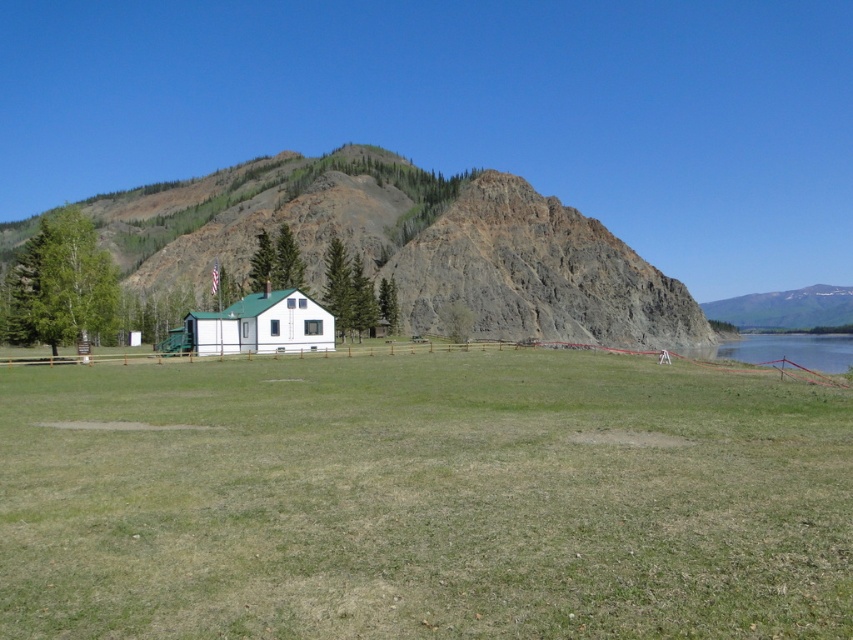
Question: Estimate the real-world distances between objects in this image. Which object is closer to the white matte cabin at center?

Choices:
 (A) green grassy field at center
 (B) rustic stone mountain at center

Answer: (A)

Question: Which of these objects is positioned closest to the green grassy field at center?

Choices:
 (A) rustic stone mountain at center
 (B) white matte cabin at center

Answer: (B)

Question: Which point is farther from the camera taking this photo?

Choices:
 (A) (283, 310)
 (B) (180, 627)
 (C) (560, 204)

Answer: (C)

Question: Is rustic stone mountain at center above white matte cabin at center?

Choices:
 (A) yes
 (B) no

Answer: (A)

Question: Can you confirm if rustic stone mountain at center is wider than white matte cabin at center?

Choices:
 (A) no
 (B) yes

Answer: (B)

Question: Does green grassy field at center have a greater width compared to rustic stone mountain at center?

Choices:
 (A) yes
 (B) no

Answer: (B)